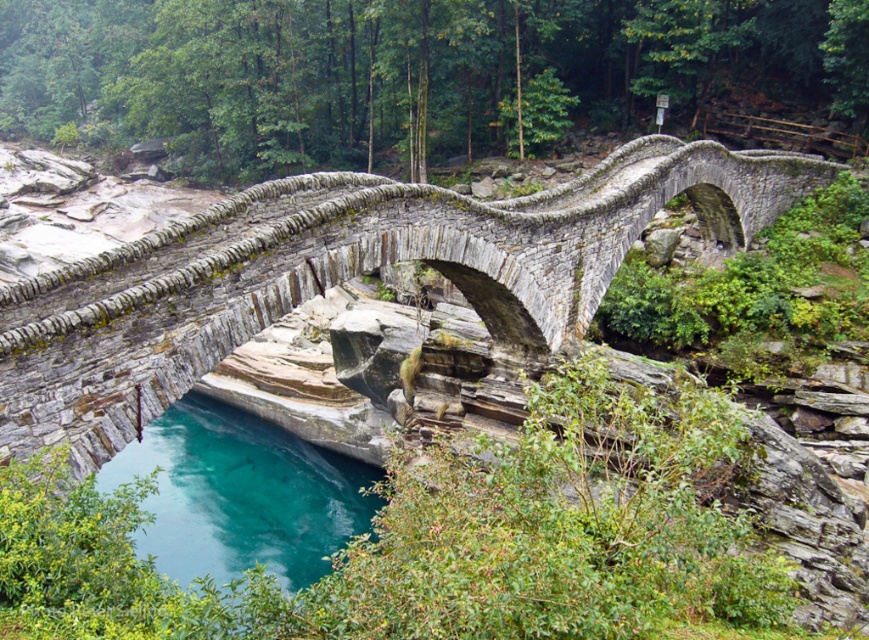
Question: Does gray stone bridge at center have a larger size compared to teal stone river at lower center?

Choices:
 (A) no
 (B) yes

Answer: (B)

Question: Which of the following is the farthest from the observer?

Choices:
 (A) (436, 250)
 (B) (222, 508)

Answer: (B)

Question: Does gray stone bridge at center lie behind teal stone river at lower center?

Choices:
 (A) yes
 (B) no

Answer: (B)

Question: Is gray stone bridge at center above teal stone river at lower center?

Choices:
 (A) yes
 (B) no

Answer: (A)

Question: Which point is farther to the camera?

Choices:
 (A) gray stone bridge at center
 (B) teal stone river at lower center

Answer: (B)